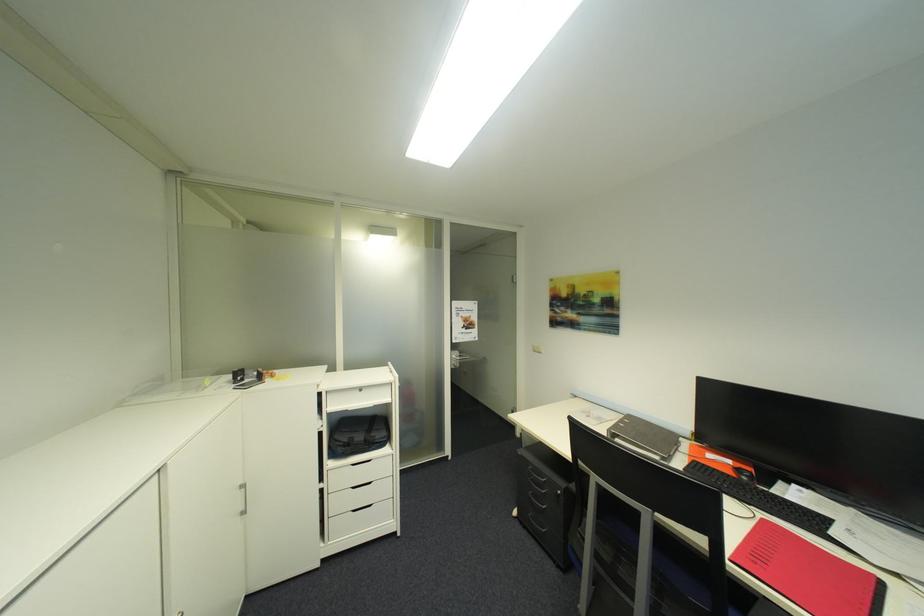
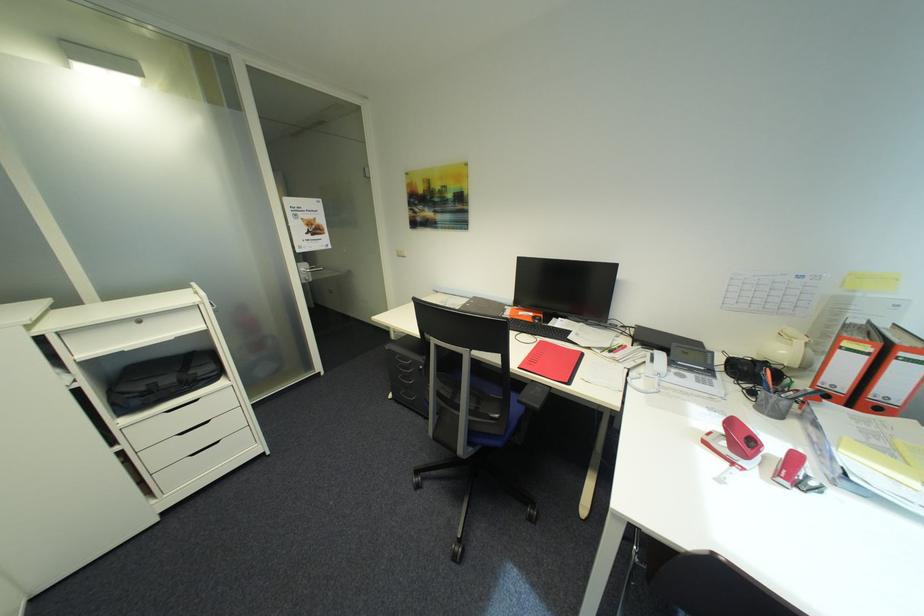
The point at (760, 524) is marked in the first image. Where is the corresponding point in the second image?

(542, 345)